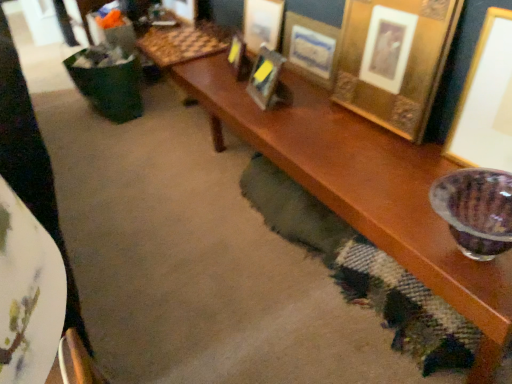
Question: Does gold metallic picture frame at upper center, the 1th picture frame when ordered from left to right, contain gold metallic picture frame at upper center, the 4th picture frame in the right-to-left sequence?

Choices:
 (A) yes
 (B) no

Answer: (B)

Question: Is gold metallic picture frame at upper center, the 1th picture frame when ordered from left to right, smaller than gold metallic picture frame at upper center, the 4th picture frame in the right-to-left sequence?

Choices:
 (A) yes
 (B) no

Answer: (A)

Question: Is gold metallic picture frame at upper center, the 1th picture frame when ordered from left to right, to the left of gold metallic picture frame at upper center, arranged as the third picture frame when viewed from the left, from the viewer's perspective?

Choices:
 (A) yes
 (B) no

Answer: (A)

Question: Is gold metallic picture frame at upper center, the 1th picture frame when ordered from left to right, oriented towards gold metallic picture frame at upper center, arranged as the third picture frame when viewed from the left?

Choices:
 (A) yes
 (B) no

Answer: (B)

Question: From the image's perspective, would you say gold metallic picture frame at upper center, which ranks as the 6th picture frame in right-to-left order, is shown under gold metallic picture frame at upper center, arranged as the third picture frame when viewed from the left?

Choices:
 (A) yes
 (B) no

Answer: (B)

Question: In terms of height, does gold metallic picture frame at upper right, which appears as the 4th picture frame when viewed from the left, look taller or shorter compared to gold metallic picture frame at upper center, the 1th picture frame when ordered from left to right?

Choices:
 (A) tall
 (B) short

Answer: (A)

Question: Is gold metallic picture frame at upper right, which appears as the 3th picture frame when viewed from the right, situated inside gold metallic picture frame at upper center, which ranks as the 6th picture frame in right-to-left order, or outside?

Choices:
 (A) inside
 (B) outside

Answer: (B)

Question: Is gold metallic picture frame at upper right, which appears as the 3th picture frame when viewed from the right, wider or thinner than gold metallic picture frame at upper center, the 1th picture frame when ordered from left to right?

Choices:
 (A) wide
 (B) thin

Answer: (B)

Question: Looking at the image, does gold metallic picture frame at upper right, which appears as the 4th picture frame when viewed from the left, seem bigger or smaller compared to gold metallic picture frame at upper center, the 1th picture frame when ordered from left to right?

Choices:
 (A) small
 (B) big

Answer: (B)

Question: In terms of width, does gold textured picture frame at upper right, the second picture frame from the right, look wider or thinner when compared to gold metallic picture frame at upper right, which appears as the 3th picture frame when viewed from the right?

Choices:
 (A) thin
 (B) wide

Answer: (B)

Question: From a real-world perspective, is gold textured picture frame at upper right, the second picture frame from the right, positioned above or below gold metallic picture frame at upper right, which appears as the 3th picture frame when viewed from the right?

Choices:
 (A) above
 (B) below

Answer: (A)

Question: Is gold textured picture frame at upper right, which appears as the fifth picture frame when viewed from the left, in front of or behind gold metallic picture frame at upper right, which appears as the 4th picture frame when viewed from the left, in the image?

Choices:
 (A) front
 (B) behind

Answer: (A)

Question: From the image's perspective, is gold textured picture frame at upper right, the second picture frame from the right, positioned above or below gold metallic picture frame at upper right, which appears as the 3th picture frame when viewed from the right?

Choices:
 (A) above
 (B) below

Answer: (B)

Question: Is point (45, 203) closer or farther from the camera than point (408, 74)?

Choices:
 (A) closer
 (B) farther

Answer: (A)

Question: Choose the correct answer: Is white fabric at lower left inside gold textured picture frame at upper right, which appears as the fifth picture frame when viewed from the left, or outside it?

Choices:
 (A) outside
 (B) inside

Answer: (A)